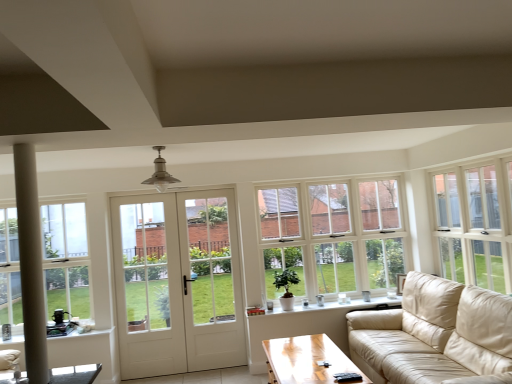
Describe the element at coordinates (307, 360) in the screenshot. This screenshot has width=512, height=384. I see `light brown wooden coffee table at lower center` at that location.

The height and width of the screenshot is (384, 512). I want to click on beige leather couch at right, so click(x=436, y=335).

This screenshot has height=384, width=512. What do you see at coordinates (332, 236) in the screenshot?
I see `white glass window at center, the third window when ordered from front to back` at bounding box center [332, 236].

Where is `light brown wooden coffee table at lower center`? Image resolution: width=512 pixels, height=384 pixels. light brown wooden coffee table at lower center is located at coordinates (307, 360).

Is white wooden door at center inside the boundaries of white ceramic windowsill at lower center, or outside?

white wooden door at center is not enclosed by white ceramic windowsill at lower center.

From a real-world perspective, relative to white ceramic windowsill at lower center, is white wooden door at center vertically above or below?

Clearly, from a real-world perspective, white wooden door at center is above white ceramic windowsill at lower center.

Which object is positioned more to the right, white wooden door at center or white ceramic windowsill at lower center?

From the viewer's perspective, white ceramic windowsill at lower center appears more on the right side.

In terms of width, does white glass window at center, the third window when ordered from front to back, look wider or thinner when compared to clear glass window at left, which is the 2th window from front to back?

Considering their sizes, white glass window at center, the third window when ordered from front to back, looks broader than clear glass window at left, which is the 2th window from front to back.

Does white glass window at center, positioned as the first window in back-to-front order, have a larger size compared to clear glass window at left, marked as the first window in a left-to-right arrangement?

Yes, white glass window at center, positioned as the first window in back-to-front order, is bigger than clear glass window at left, marked as the first window in a left-to-right arrangement.

From the image's perspective, is white glass window at center, positioned as the first window in back-to-front order, on clear glass window at left, which is the 2th window from front to back?

Yes.

Could you tell me if light brown wooden coffee table at lower center is turned towards white glass door at center?

No, light brown wooden coffee table at lower center does not turn towards white glass door at center.

From a real-world perspective, between light brown wooden coffee table at lower center and white glass door at center, who is vertically lower?

light brown wooden coffee table at lower center, from a real-world perspective.

Which object is more forward, light brown wooden coffee table at lower center or white glass door at center?

light brown wooden coffee table at lower center is more forward.

Considering the sizes of objects light brown wooden coffee table at lower center and white glass door at center in the image provided, who is taller, light brown wooden coffee table at lower center or white glass door at center?

With more height is white glass door at center.

Is there a large distance between white wooden door at center and white glass window at center, the third window when ordered from front to back?

Yes, white wooden door at center is far from white glass window at center, the third window when ordered from front to back.

From the image's perspective, which one is positioned higher, white wooden door at center or white glass window at center, the 2th window from the right?

white glass window at center, the 2th window from the right, is shown above in the image.

Considering the positions of objects white wooden door at center and white glass window at center, positioned as the first window in back-to-front order, in the image provided, who is in front, white wooden door at center or white glass window at center, positioned as the first window in back-to-front order,?

white wooden door at center is more forward.

Consider the image. Which is closer to the camera, [200,246] or [307,282]?

Point [200,246] is positioned closer to the camera compared to point [307,282].

From the image's perspective, which one is positioned lower, clear glass window at left, marked as the first window in a left-to-right arrangement, or white glass window at upper right, which ranks as the third window in left-to-right order?

From the image's view, clear glass window at left, marked as the first window in a left-to-right arrangement, is below.

Is clear glass window at left, which ranks as the 2th window in back-to-front order, looking in the opposite direction of white glass window at upper right, marked as the 3th window in a back-to-front arrangement?

No.

Considering the sizes of objects clear glass window at left, which ranks as the 2th window in back-to-front order, and white glass window at upper right, marked as the 3th window in a back-to-front arrangement, in the image provided, who is taller, clear glass window at left, which ranks as the 2th window in back-to-front order, or white glass window at upper right, marked as the 3th window in a back-to-front arrangement,?

With more height is clear glass window at left, which ranks as the 2th window in back-to-front order.

The width and height of the screenshot is (512, 384). I want to click on screen door that appears below the clear glass window at left, which is the 2th window from front to back (from a real-world perspective), so 211,281.

From the picture: From a real-world perspective, which object rests below the other?

In real-world perspective, white glass door at center is lower.

Are clear glass window at left, placed as the third window when sorted from right to left, and white glass door at center located far from each other?

Yes, clear glass window at left, placed as the third window when sorted from right to left, and white glass door at center are located far from each other.

Is clear glass window at left, marked as the first window in a left-to-right arrangement, located outside white glass door at center?

Absolutely, clear glass window at left, marked as the first window in a left-to-right arrangement, is external to white glass door at center.

Is beige leather couch at right smaller than white glass window at center, the third window when ordered from front to back?

Actually, beige leather couch at right might be larger than white glass window at center, the third window when ordered from front to back.

Which object is positioned more to the left, beige leather couch at right or white glass window at center, positioned as the first window in back-to-front order?

white glass window at center, positioned as the first window in back-to-front order.

From their relative heights in the image, would you say beige leather couch at right is taller or shorter than white glass window at center, placed as the second window when sorted from left to right?

Considering their sizes, beige leather couch at right has less height than white glass window at center, placed as the second window when sorted from left to right.

Measure the distance from beige leather couch at right to white glass window at center, the third window when ordered from front to back.

beige leather couch at right and white glass window at center, the third window when ordered from front to back, are 1.22 meters apart from each other.

At what (x,y) coordinates should I click in order to perform the action: click on door on the left of white ceramic windowsill at lower center. Please return your answer as a coordinate pair (x, y). The height and width of the screenshot is (384, 512). Looking at the image, I should click on (177, 283).

You are a GUI agent. You are given a task and a screenshot of the screen. Output one action in this format:
    pyautogui.click(x=<x>, y=<y>)
    Task: Click on the window below the white glass window at center, placed as the second window when sorted from left to right (from the image's perspective)
    The height and width of the screenshot is (384, 512).
    Given the screenshot: What is the action you would take?
    pyautogui.click(x=66, y=259)

Considering their positions, is white glass window at center, the 2th window from the right, positioned further to white wooden door at center than white glass door at center?

Among the two, white glass window at center, the 2th window from the right, is located further to white wooden door at center.

When comparing their distances from beige leather couch at right, does white ceramic windowsill at lower center or white glass window at upper right, the first window when ordered from front to back, seem closer?

white glass window at upper right, the first window when ordered from front to back.

When comparing their distances from beige leather couch at right, does white wooden door at center or white glass door at center seem further?

white wooden door at center lies further to beige leather couch at right than the other object.

Looking at the image, which one is located closer to clear glass window at left, which is the 2th window from front to back, white glass window at center, the 2th window from the right, or white glass door at center?

The object closer to clear glass window at left, which is the 2th window from front to back, is white glass door at center.

Looking at the image, which one is located closer to light brown wooden coffee table at lower center, beige leather couch at right or white wooden door at center?

beige leather couch at right.

Estimate the real-world distances between objects in this image. Which object is closer to white ceramic windowsill at lower center, clear glass window at left, which ranks as the 2th window in back-to-front order, or beige leather couch at right?

Among the two, beige leather couch at right is located nearer to white ceramic windowsill at lower center.

Considering their positions, is white glass door at center positioned closer to white glass window at center, the 2th window from the right, than clear glass window at left, which ranks as the 2th window in back-to-front order?

white glass door at center.

Estimate the real-world distances between objects in this image. Which object is closer to white ceramic windowsill at lower center, white glass window at center, positioned as the first window in back-to-front order, or beige leather couch at right?

The object closer to white ceramic windowsill at lower center is white glass window at center, positioned as the first window in back-to-front order.

Identify the location of window sill between light brown wooden coffee table at lower center and white glass window at center, placed as the second window when sorted from left to right, in the front-back direction. The width and height of the screenshot is (512, 384). (338, 305).

The width and height of the screenshot is (512, 384). I want to click on coffee table situated between white glass door at center and white glass window at upper right, the first window when ordered from front to back, from left to right, so click(x=307, y=360).

The image size is (512, 384). I want to click on coffee table between beige leather couch at right and white wooden door at center along the z-axis, so point(307,360).

Locate an element on the screen. window sill between white glass door at center and white glass window at center, the third window when ordered from front to back, in the horizontal direction is located at coordinates (338, 305).